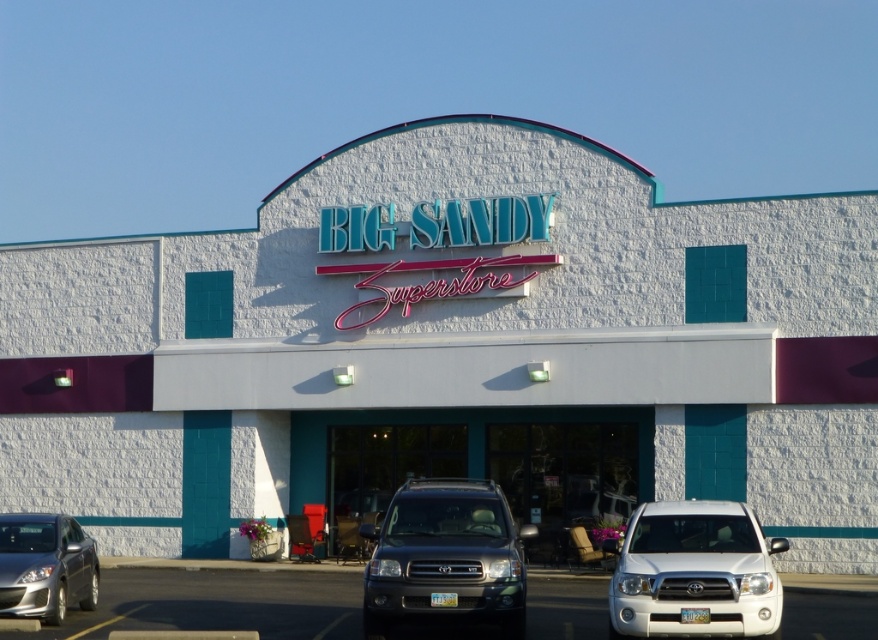
Can you confirm if satin white suv at lower right is wider than silver metallic sedan at lower left?

Incorrect, satin white suv at lower right's width does not surpass silver metallic sedan at lower left's.

Describe the element at coordinates (695, 573) in the screenshot. I see `satin white suv at lower right` at that location.

At what (x,y) coordinates should I click in order to perform the action: click on satin white suv at lower right. Please return your answer as a coordinate pair (x, y). The height and width of the screenshot is (640, 878). Looking at the image, I should click on (695, 573).

Between metallic gray suvs at center and silver metallic sedan at lower left, which one has more height?

Standing taller between the two is metallic gray suvs at center.

Between point (577, 616) and point (56, 568), which one is positioned behind?

The point (577, 616) is more distant.

Locate an element on the screen. metallic gray suvs at center is located at coordinates (220, 604).

Does white stucco building at center have a lesser width compared to silver metallic sedan at lower left?

Incorrect, white stucco building at center's width is not less than silver metallic sedan at lower left's.

Which is in front, point (833, 424) or point (70, 572)?

Point (70, 572) is in front.

Where is `white stucco building at center`? The height and width of the screenshot is (640, 878). white stucco building at center is located at coordinates (452, 349).